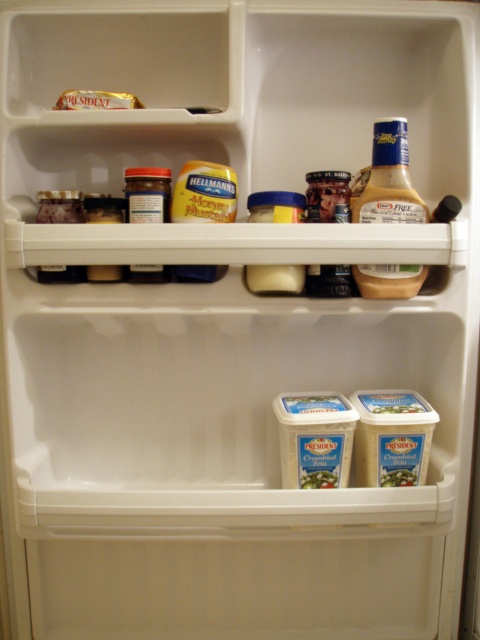
You are organizing items in a refrigerator and need to place a new item between the matte glass jar at upper center and the matte plastic mustard at upper left. Given that the new item is 10 cm tall, will it fit vertically between them?

The matte glass jar at upper center is taller than the matte plastic mustard at upper left. Since the new item is 10 cm tall, it will fit vertically between them as long as the space between their heights accommodates it. However, without knowing the exact heights of both items, we can only confirm that the vertical space exists because the jar is taller than the mustard.

You need to place a new jar of jam between the yellow mustard at center and the gold foil wrapped cheese at upper left in the refrigerator. According to the current arrangement, where should you position the new jar?

The yellow mustard at center is to the right of the gold foil wrapped cheese at upper left, so you should place the new jar of jam between them to the left of the yellow mustard at center and to the right of the gold foil wrapped cheese at upper left.

You are trying to locate the matte glass jar at upper center in the refrigerator. According to the coordinates provided, where exactly would you find it?

The matte glass jar at upper center is located at point (147,195).